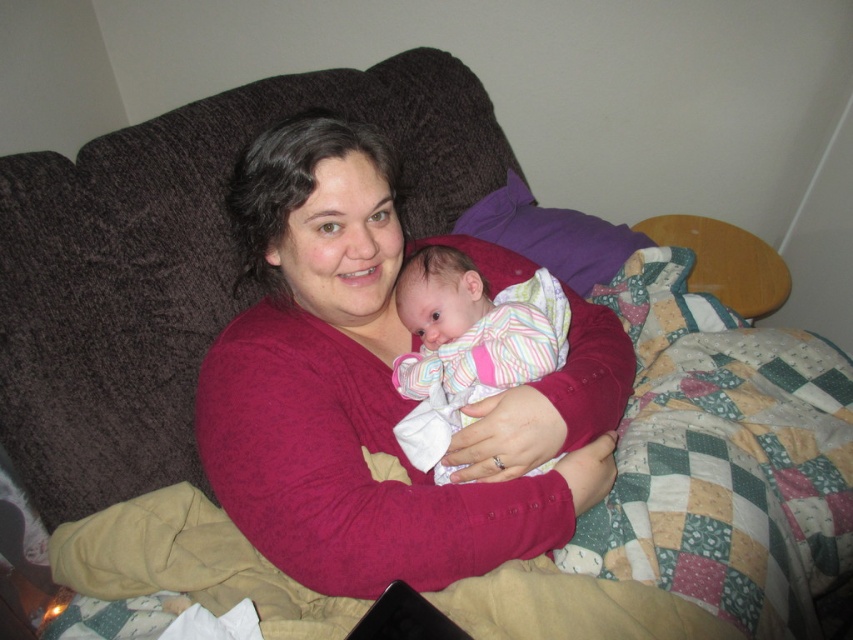
You are a photographer setting up for a family portrait. The cotton sweater at center and the striped cotton baby at center are both in the frame. If you want to ensure both are visible, which object should you focus on first to avoid blurring?

You should focus on the cotton sweater at center first because it is larger in size than the striped cotton baby at center, making it easier to capture clearly.

You are a photographer setting up a shoot in this living room. You need to place a small prop exactly at the point where the cotton sweater at center is located. According to the coordinates provided, where should you place the prop?

The cotton sweater at center is located at coordinates point (376, 390), so place the prop there.

You are a photographer taking a picture of the cotton sweater at center and the striped cotton baby at center. Which object will appear closer to the camera in the photo?

The cotton sweater at center is in front of the striped cotton baby at center, so it will appear closer to the camera in the photo.